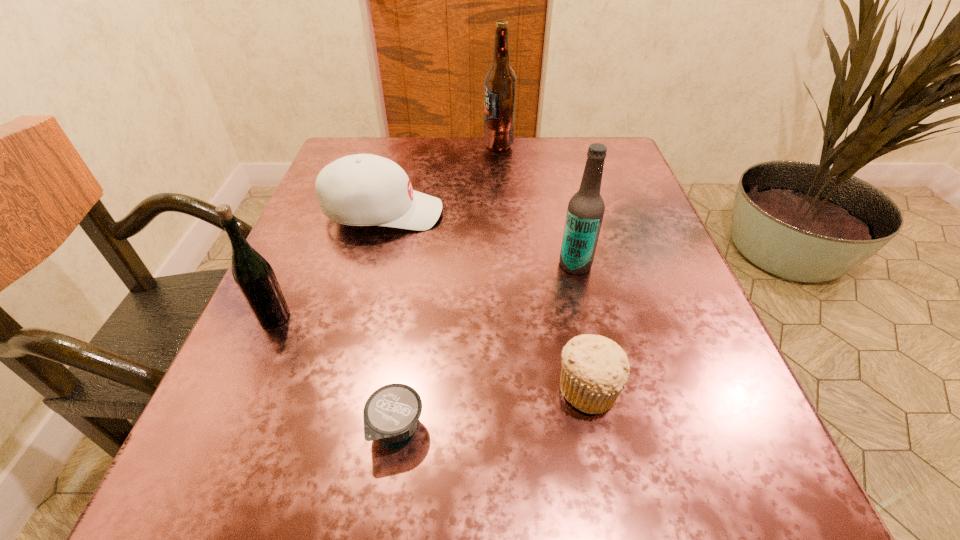
The height and width of the screenshot is (540, 960). Find the location of `vacant space at the near left corner`. vacant space at the near left corner is located at coordinates (260, 507).

Find the location of `free area in between the third shortest object and the yogurt`. free area in between the third shortest object and the yogurt is located at coordinates (390, 320).

The width and height of the screenshot is (960, 540). I want to click on free spot between the muffin and the nearest beer bottle, so click(431, 353).

The height and width of the screenshot is (540, 960). What are the coordinates of `vacant point located between the third farthest object and the second farthest object` in the screenshot? It's located at (479, 239).

Where is `vacant point located between the shortest object and the rightmost beer bottle`? The height and width of the screenshot is (540, 960). vacant point located between the shortest object and the rightmost beer bottle is located at coordinates (x=486, y=346).

You are a GUI agent. You are given a task and a screenshot of the screen. Output one action in this format:
    pyautogui.click(x=<x>, y=<y>)
    Task: Click on the free spot between the second beer bottle from right to left and the leftmost beer bottle
    The width and height of the screenshot is (960, 540).
    Given the screenshot: What is the action you would take?
    pyautogui.click(x=386, y=231)

Image resolution: width=960 pixels, height=540 pixels. I want to click on free space between the second shortest object and the leftmost beer bottle, so click(x=431, y=353).

Find the location of a particular element. Image resolution: width=960 pixels, height=540 pixels. empty space between the second nearest beer bottle and the fourth tallest object is located at coordinates tap(479, 239).

You are a GUI agent. You are given a task and a screenshot of the screen. Output one action in this format:
    pyautogui.click(x=<x>, y=<y>)
    Task: Click on the unoccupied area between the fourth object from left to right and the third nearest object
    The height and width of the screenshot is (540, 960).
    Given the screenshot: What is the action you would take?
    pyautogui.click(x=386, y=231)

The width and height of the screenshot is (960, 540). I want to click on free space that is in between the second shortest object and the yogurt, so click(492, 408).